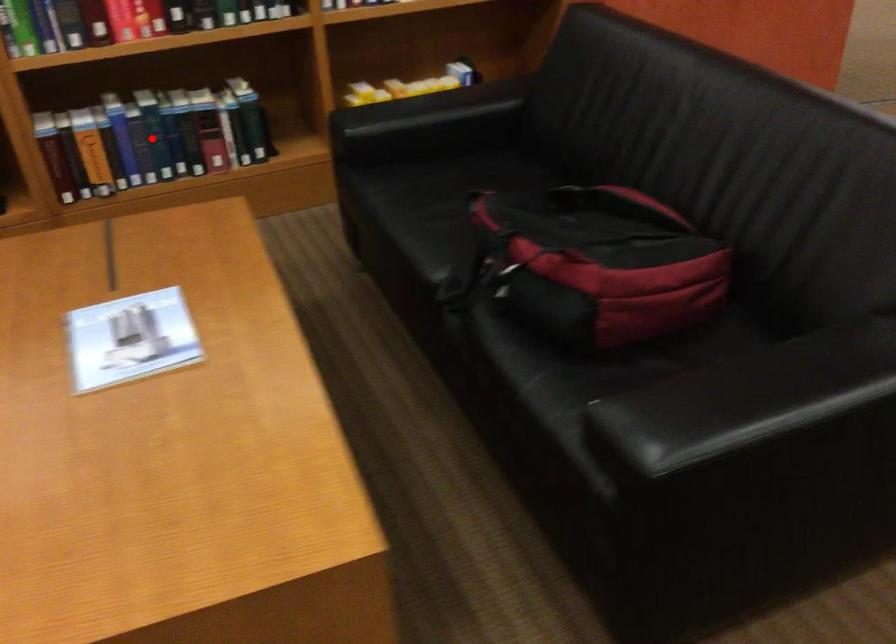
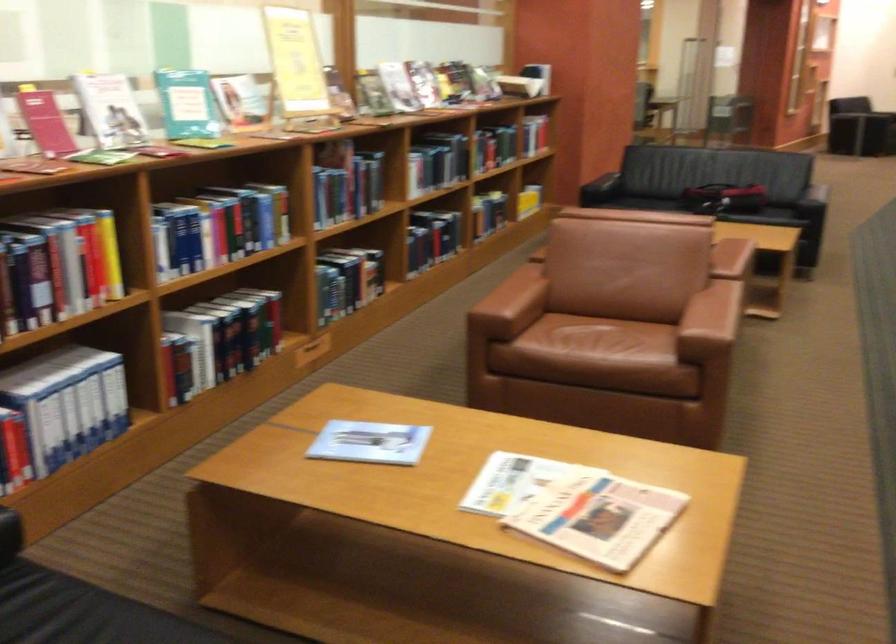
The point at the highlighted location is marked in the first image. Where is the corresponding point in the second image?

(504, 207)